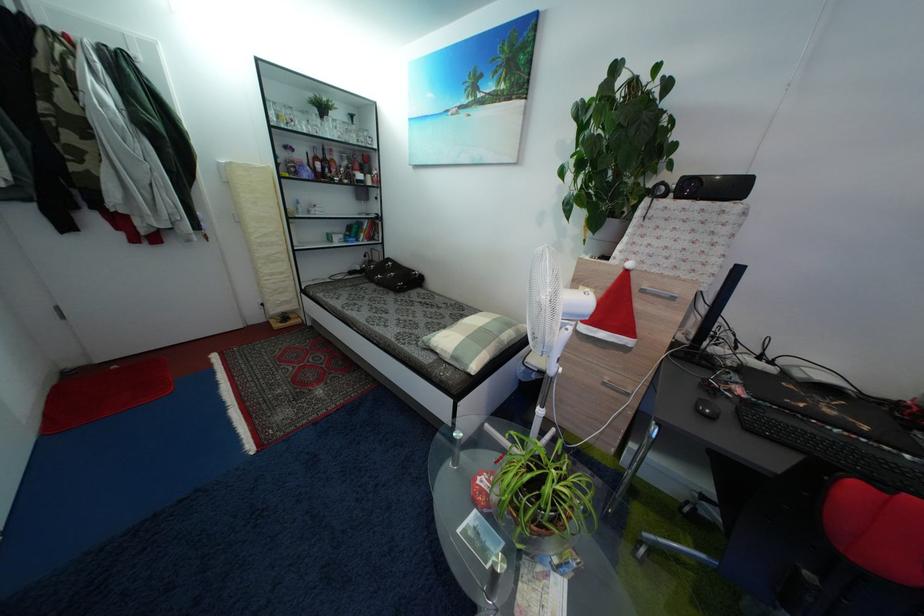
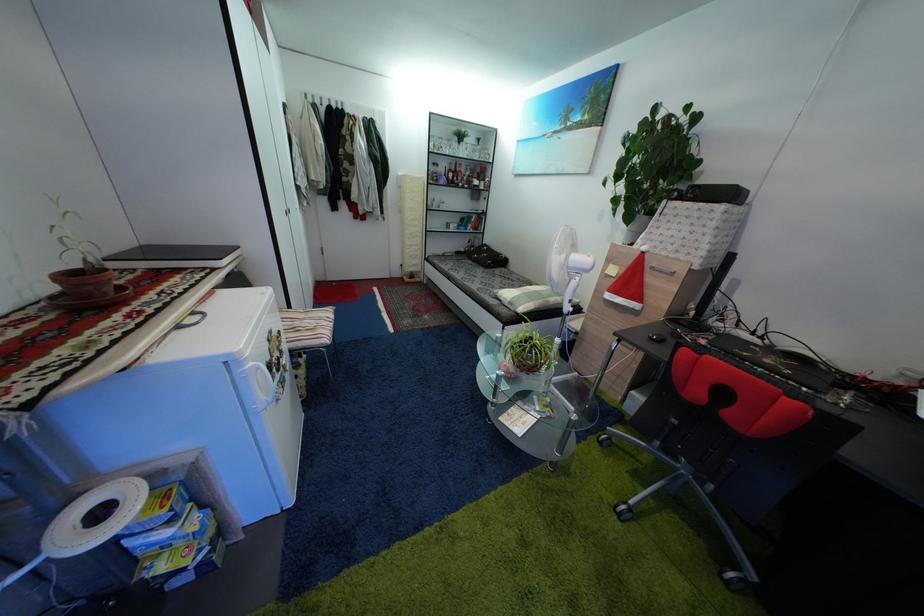
Find the pixel in the second image that matches [300,156] in the first image.

(445, 172)